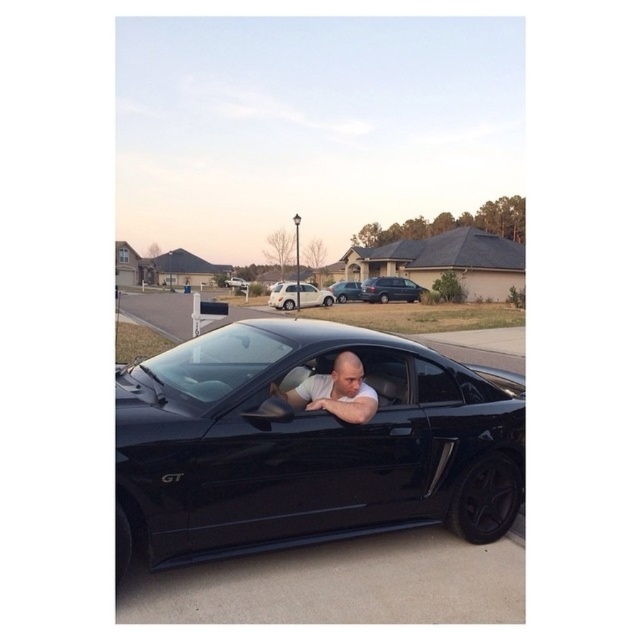
Is smooth white shirt at center shorter than satin silver suv at center?

Yes.

In order to click on smooth white shirt at center in this screenshot , I will do `click(336, 392)`.

In the scene shown: Who is more forward, (356, 394) or (340, 294)?

Positioned in front is point (356, 394).

Where is `smooth white shirt at center`? smooth white shirt at center is located at coordinates (336, 392).

Is point (385, 285) behind point (230, 282)?

No, (385, 285) is in front of (230, 282).

Can you confirm if matte gray minivan at center is bigger than black glossy car at center?

Actually, matte gray minivan at center might be smaller than black glossy car at center.

At what (x,y) coordinates should I click in order to perform the action: click on matte gray minivan at center. Please return your answer as a coordinate pair (x, y). This screenshot has width=640, height=640. Looking at the image, I should click on (390, 289).

This screenshot has width=640, height=640. What are the coordinates of `matte gray minivan at center` in the screenshot? It's located at (390, 289).

Who is more distant from viewer, (394,296) or (276,308)?

Positioned behind is point (394,296).

Who is taller, matte gray minivan at center or white matte suv at center?

white matte suv at center

Is point (403, 285) more distant than point (330, 298)?

No, it is in front of (330, 298).

This screenshot has width=640, height=640. Identify the location of matte gray minivan at center. (390, 289).